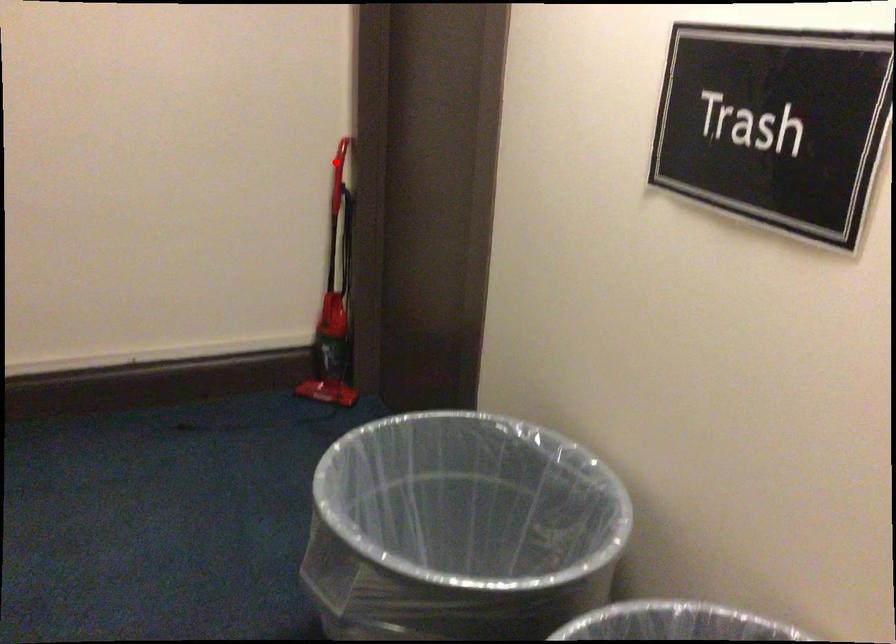
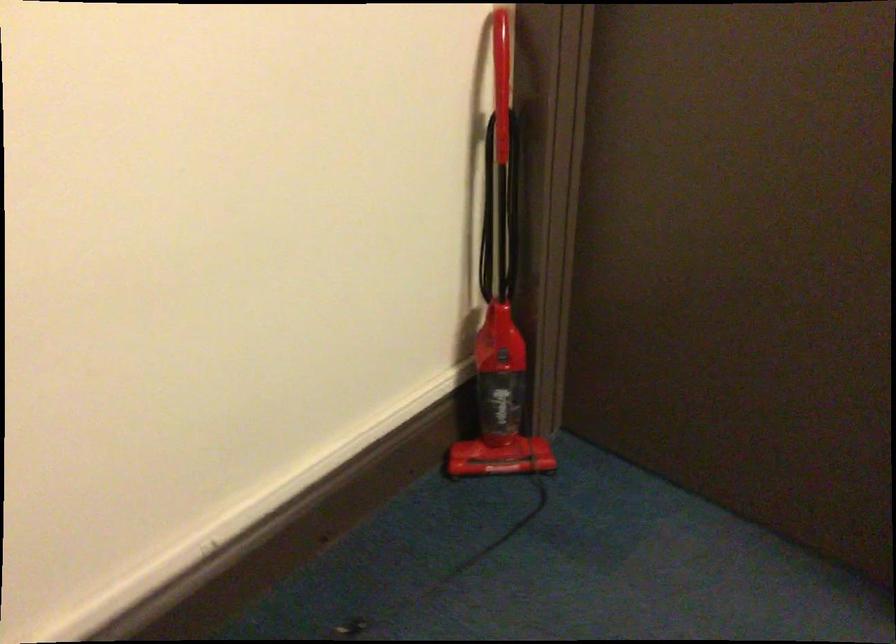
Question: I am providing you with two images of the same scene from different viewpoints. In image1, a red point is highlighted. Considering the same 3D point in image2, which of the following is correct?

Choices:
 (A) It is closer
 (B) It is farther

Answer: (A)